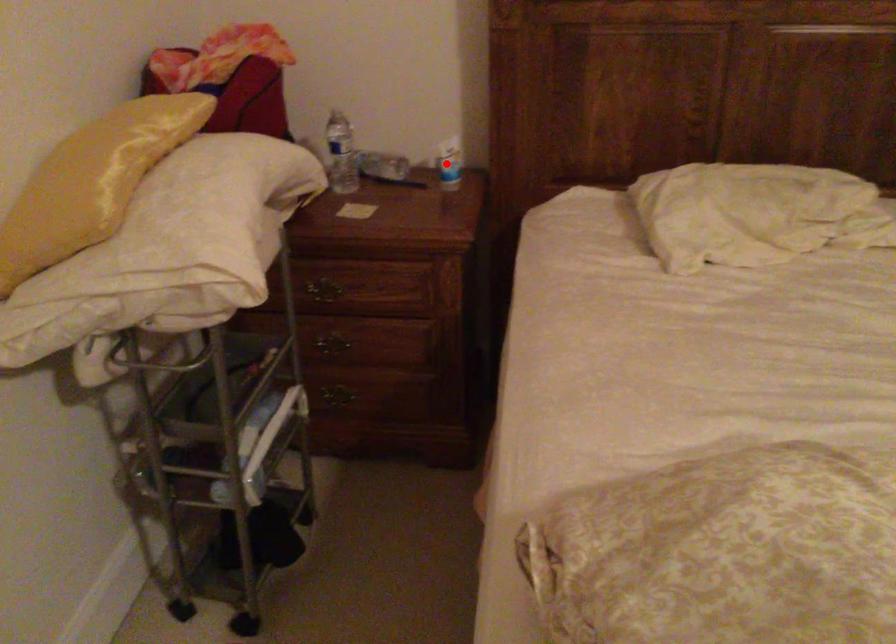
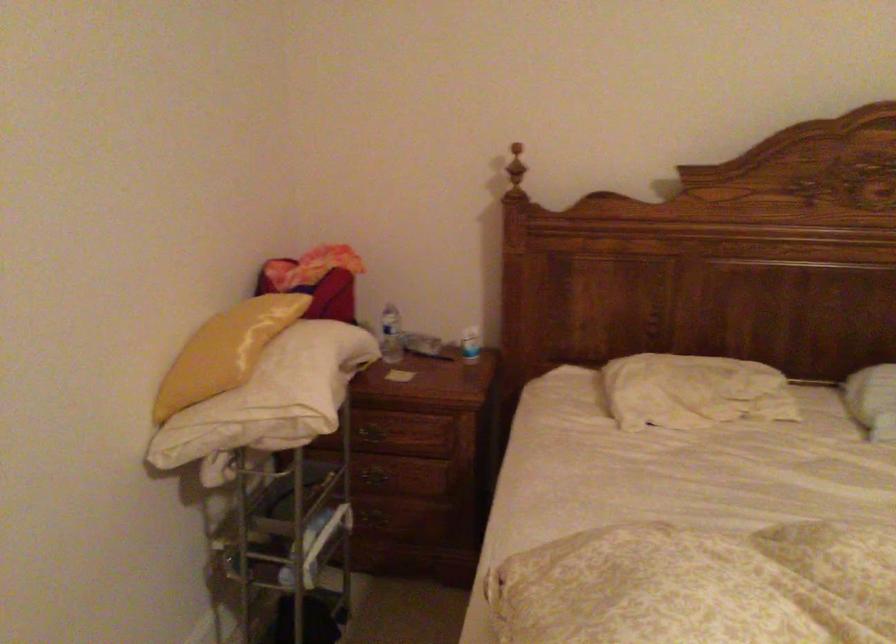
Find the pixel in the second image that matches the highlighted location in the first image.

(470, 344)